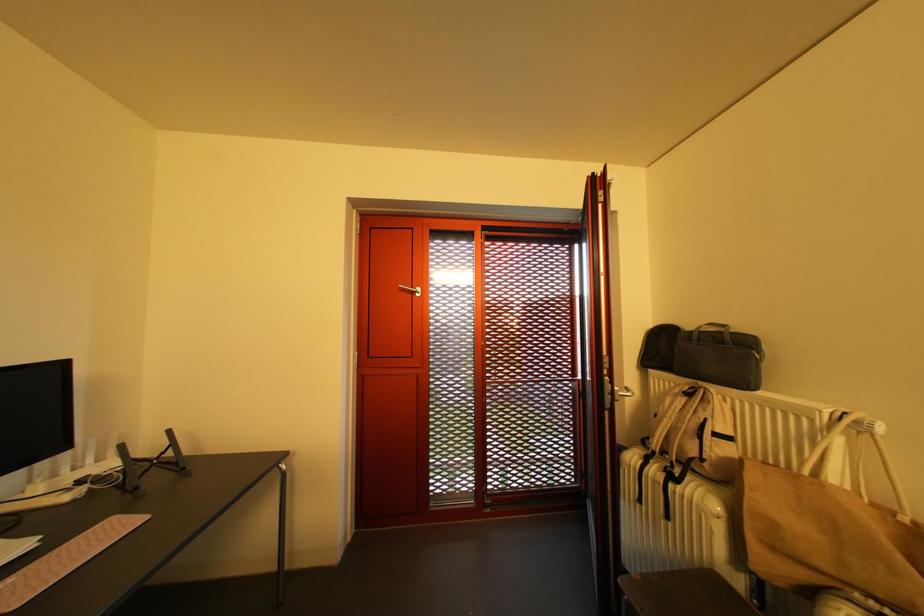
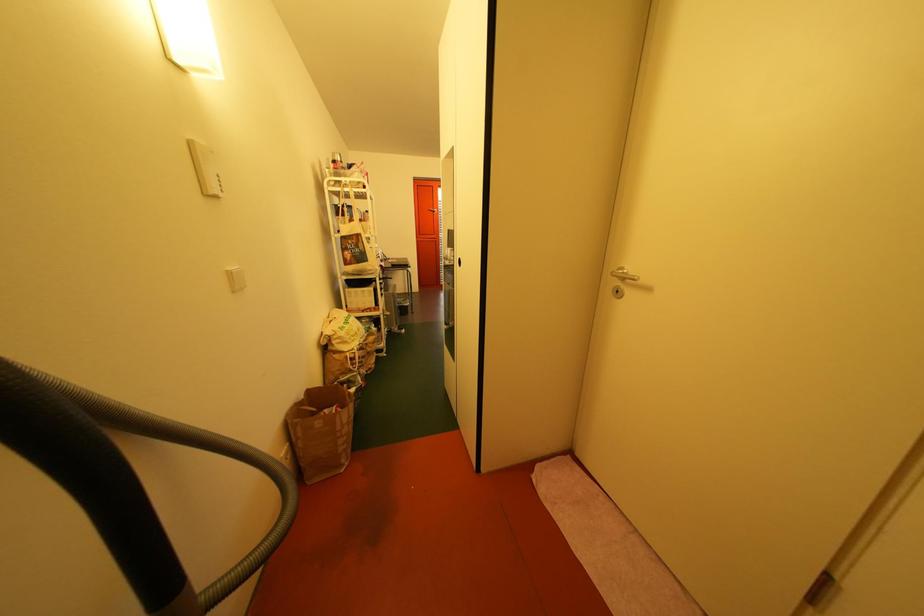
Question: Which direction would the cameraman need to move to produce the second image? Reply with the corresponding letter.

Choices:
 (A) Left
 (B) Right
 (C) Forward
 (D) Backward

Answer: (D)